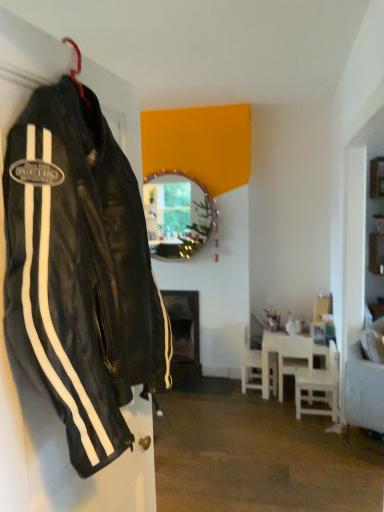
Find the location of a particular element. Image resolution: width=384 pixels, height=512 pixels. free space that is to the left of white wooden table at lower right is located at coordinates (221, 392).